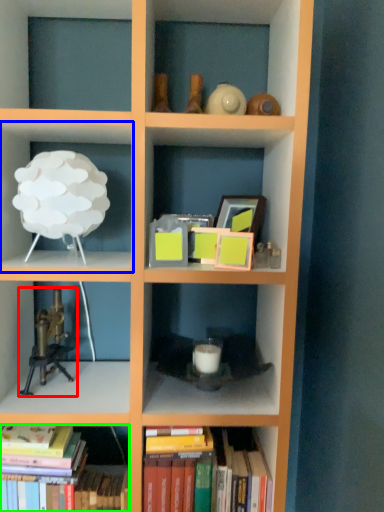
Question: Which object is positioned farthest from toy (highlighted by a red box)? Select from shelf (highlighted by a blue box) and book (highlighted by a green box).

Choices:
 (A) shelf
 (B) book

Answer: (A)